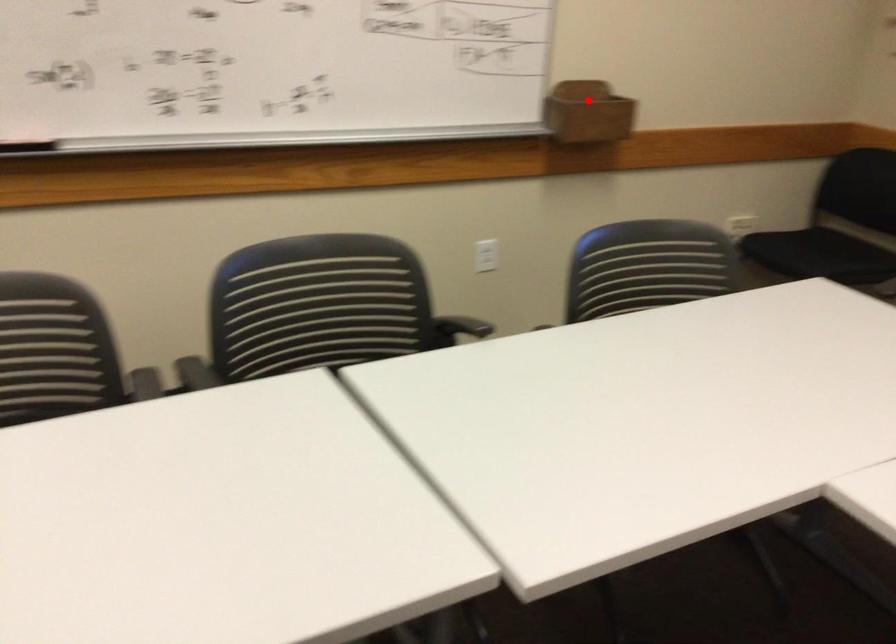
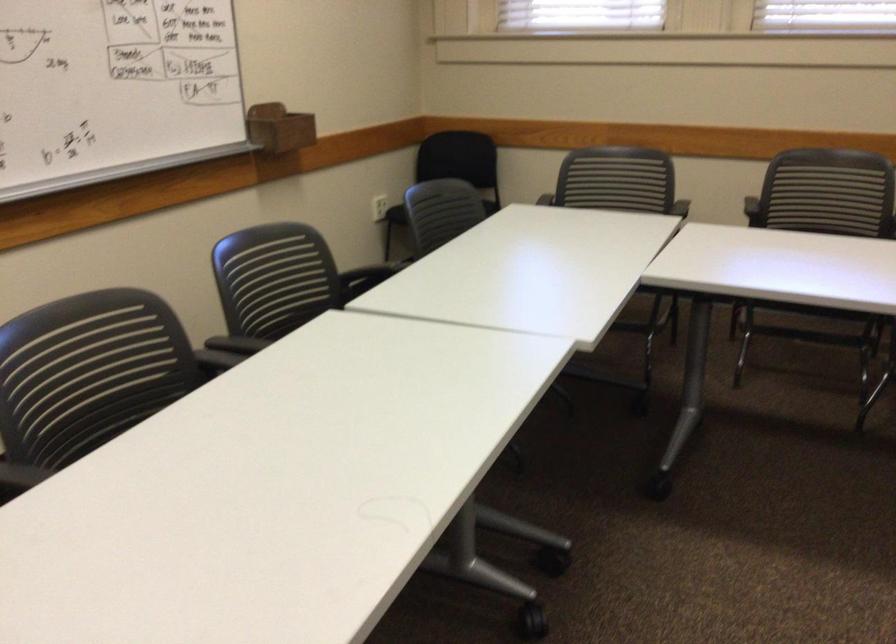
Question: I am providing you with two images of the same scene from different viewpoints. A red point is shown in image1. For the corresponding object point in image2, is it positioned nearer or farther from the camera?

Choices:
 (A) Nearer
 (B) Farther

Answer: (B)